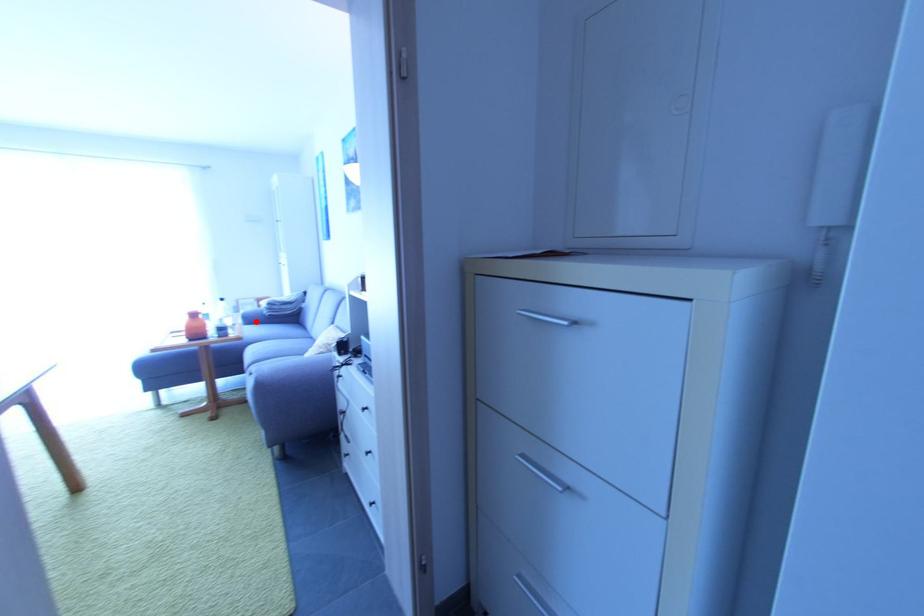
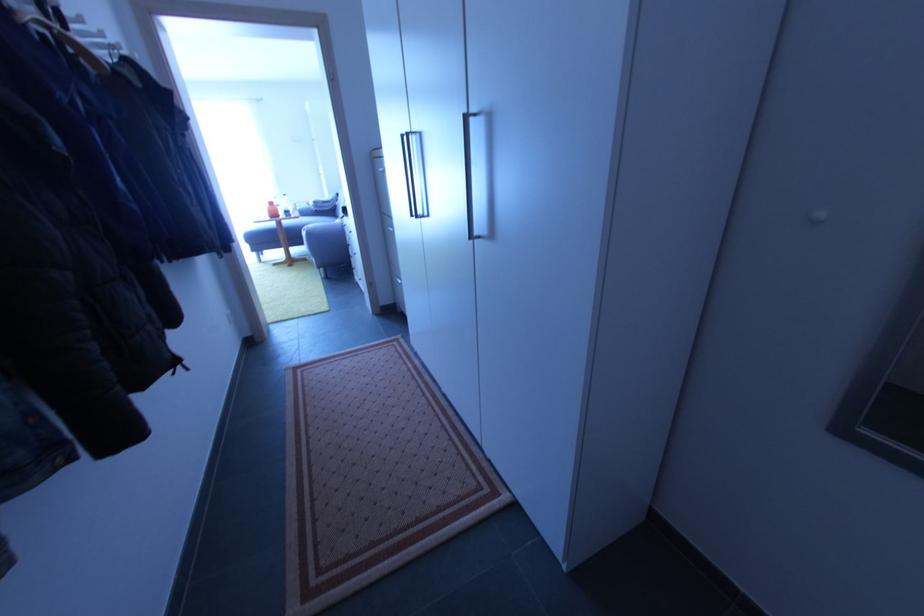
Question: A red point is marked in image1. In image2, is the corresponding 3D point closer to the camera or farther? Reply with the corresponding letter.

Choices:
 (A) The corresponding 3D point is closer.
 (B) The corresponding 3D point is farther.

Answer: (A)